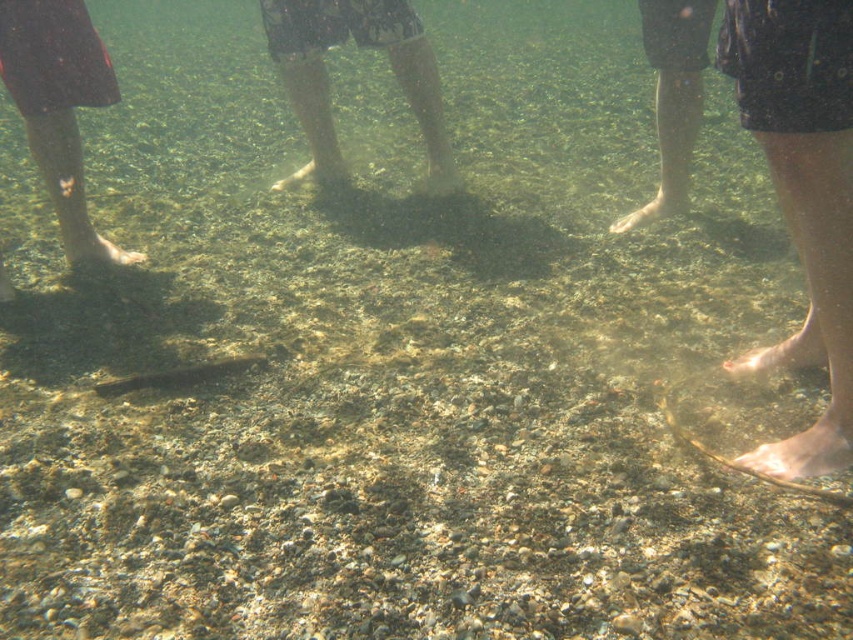
Who is shorter, smooth skin foot at lower right or brown matte foot at lower right?

Standing shorter between the two is smooth skin foot at lower right.

Which is in front, point (766, 467) or point (660, 182)?

Positioned in front is point (766, 467).

Where is `smooth skin foot at lower right`? smooth skin foot at lower right is located at coordinates (804, 451).

The width and height of the screenshot is (853, 640). What do you see at coordinates (326, 72) in the screenshot?
I see `dark gray shorts at center` at bounding box center [326, 72].

Which is behind, point (312, 109) or point (784, 467)?

Positioned behind is point (312, 109).

You are a GUI agent. You are given a task and a screenshot of the screen. Output one action in this format:
    pyautogui.click(x=<x>, y=<y>)
    Task: Click on the dark gray shorts at center
    This screenshot has height=640, width=853.
    Given the screenshot: What is the action you would take?
    pyautogui.click(x=326, y=72)

Is matte black shorts at left positioned before brown matte sand at center?

Yes.

Locate an element on the screen. The height and width of the screenshot is (640, 853). matte black shorts at left is located at coordinates (59, 106).

Where is `matte black shorts at left`? The height and width of the screenshot is (640, 853). matte black shorts at left is located at coordinates (59, 106).